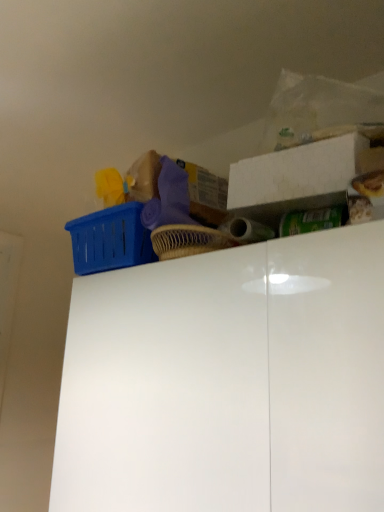
What do you see at coordinates (295, 172) in the screenshot?
I see `white matte storage box at upper right` at bounding box center [295, 172].

This screenshot has height=512, width=384. Find the location of `white matte storage box at upper right`. white matte storage box at upper right is located at coordinates (295, 172).

The image size is (384, 512). What do you see at coordinates (228, 381) in the screenshot? I see `white glossy cabinet at upper center` at bounding box center [228, 381].

You are a GUI agent. You are given a task and a screenshot of the screen. Output one action in this format:
    pyautogui.click(x=<x>, y=<y>)
    Task: Click on the white glossy cabinet at upper center
    This screenshot has width=384, height=512.
    Given the screenshot: What is the action you would take?
    pyautogui.click(x=228, y=381)

Identify the location of white matte storage box at upper right. (295, 172).

Between white glossy cabinet at upper center and white matte storage box at upper right, which one appears on the left side from the viewer's perspective?

From the viewer's perspective, white glossy cabinet at upper center appears more on the left side.

Considering the relative positions of white glossy cabinet at upper center and white matte storage box at upper right in the image provided, is white glossy cabinet at upper center in front of white matte storage box at upper right?

Yes, white glossy cabinet at upper center is closer to the camera.

Which is nearer, (278, 383) or (331, 149)?

The point (278, 383) is more forward.

From the image's perspective, is white glossy cabinet at upper center located above or below white matte storage box at upper right?

From the image's perspective, white glossy cabinet at upper center appears below white matte storage box at upper right.

From a real-world perspective, is white glossy cabinet at upper center positioned over white matte storage box at upper right based on gravity?

No, from a real-world perspective, white glossy cabinet at upper center is not over white matte storage box at upper right

Which of these two, white glossy cabinet at upper center or white matte storage box at upper right, is thinner?

white matte storage box at upper right is thinner.

Considering the relative sizes of white glossy cabinet at upper center and white matte storage box at upper right in the image provided, is white glossy cabinet at upper center shorter than white matte storage box at upper right?

No.

Is white glossy cabinet at upper center smaller than white matte storage box at upper right?

Actually, white glossy cabinet at upper center might be larger than white matte storage box at upper right.

From the picture: Would you say white glossy cabinet at upper center contains white matte storage box at upper right?

No.

Would you consider white glossy cabinet at upper center to be distant from white matte storage box at upper right?

Actually, white glossy cabinet at upper center and white matte storage box at upper right are a little close together.

Looking at this image, does white glossy cabinet at upper center turn towards white matte storage box at upper right?

No, white glossy cabinet at upper center is not facing towards white matte storage box at upper right.

In the scene shown: What's the angular difference between white glossy cabinet at upper center and white matte storage box at upper right's facing directions?

white glossy cabinet at upper center and white matte storage box at upper right are facing 92.2 degrees away from each other.

This screenshot has height=512, width=384. In the image, there is a white matte storage box at upper right. What are the coordinates of `cabinetry below it (from a real-world perspective)` in the screenshot? It's located at (228, 381).

Does white matte storage box at upper right appear on the right side of white glossy cabinet at upper center?

Yes, white matte storage box at upper right is to the right of white glossy cabinet at upper center.

In the image, is white matte storage box at upper right positioned in front of or behind white glossy cabinet at upper center?

white matte storage box at upper right is behind white glossy cabinet at upper center.

Between point (259, 167) and point (103, 388), which one is positioned behind?

Positioned behind is point (103, 388).

From the image's perspective, is white matte storage box at upper right beneath white glossy cabinet at upper center?

No, from the image's perspective, white matte storage box at upper right is not below white glossy cabinet at upper center.

From a real-world perspective, is white matte storage box at upper right beneath white glossy cabinet at upper center?

Incorrect, from a real-world perspective, white matte storage box at upper right is higher than white glossy cabinet at upper center.

Consider the image. In terms of width, does white matte storage box at upper right look wider or thinner when compared to white glossy cabinet at upper center?

white matte storage box at upper right is thinner than white glossy cabinet at upper center.

Who is shorter, white matte storage box at upper right or white glossy cabinet at upper center?

Standing shorter between the two is white matte storage box at upper right.

Considering the sizes of objects white matte storage box at upper right and white glossy cabinet at upper center in the image provided, who is bigger, white matte storage box at upper right or white glossy cabinet at upper center?

Bigger between the two is white glossy cabinet at upper center.

Do you think white matte storage box at upper right is within white glossy cabinet at upper center, or outside of it?

white matte storage box at upper right is outside white glossy cabinet at upper center.

Is white matte storage box at upper right next to white glossy cabinet at upper center?

white matte storage box at upper right and white glossy cabinet at upper center are clearly separated.

Is white matte storage box at upper right aimed at white glossy cabinet at upper center?

No, white matte storage box at upper right does not turn towards white glossy cabinet at upper center.

How many degrees apart are the facing directions of white matte storage box at upper right and white glossy cabinet at upper center?

They differ by 92.2 degrees in their facing directions.

This screenshot has height=512, width=384. Find the location of `storage box that is above the white glossy cabinet at upper center (from the image's perspective)`. storage box that is above the white glossy cabinet at upper center (from the image's perspective) is located at coordinates (295, 172).

Find the location of a particular element. This screenshot has height=512, width=384. cabinetry to the left of white matte storage box at upper right is located at coordinates (228, 381).

This screenshot has height=512, width=384. What are the coordinates of `cabinetry directly beneath the white matte storage box at upper right (from a real-world perspective)` in the screenshot? It's located at (228, 381).